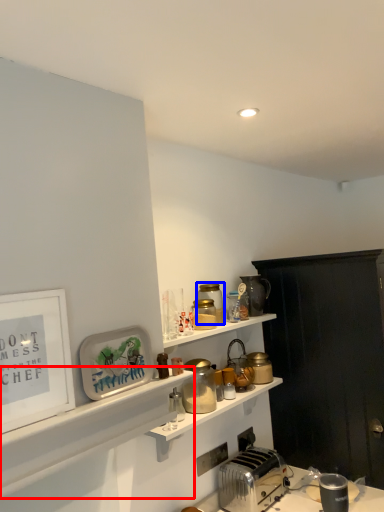
Question: Which object is closer to the camera taking this photo, shelf (highlighted by a red box) or appliance (highlighted by a blue box)?

Choices:
 (A) shelf
 (B) appliance

Answer: (A)